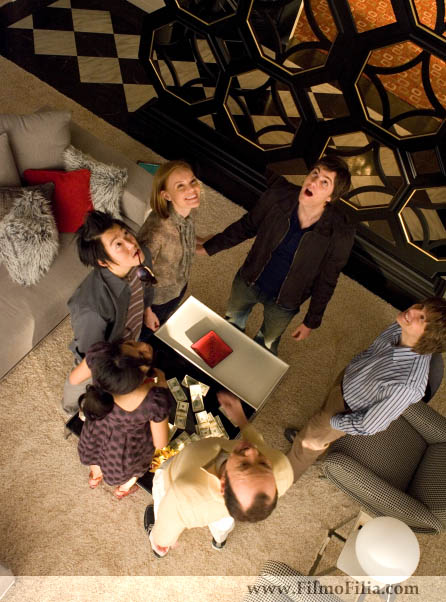
You are a GUI agent. You are given a task and a screenshot of the screen. Output one action in this format:
    pyautogui.click(x=<x>, y=<y>)
    Task: Click on the chair
    The image size is (446, 602).
    Given the screenshot: What is the action you would take?
    pyautogui.click(x=413, y=433)